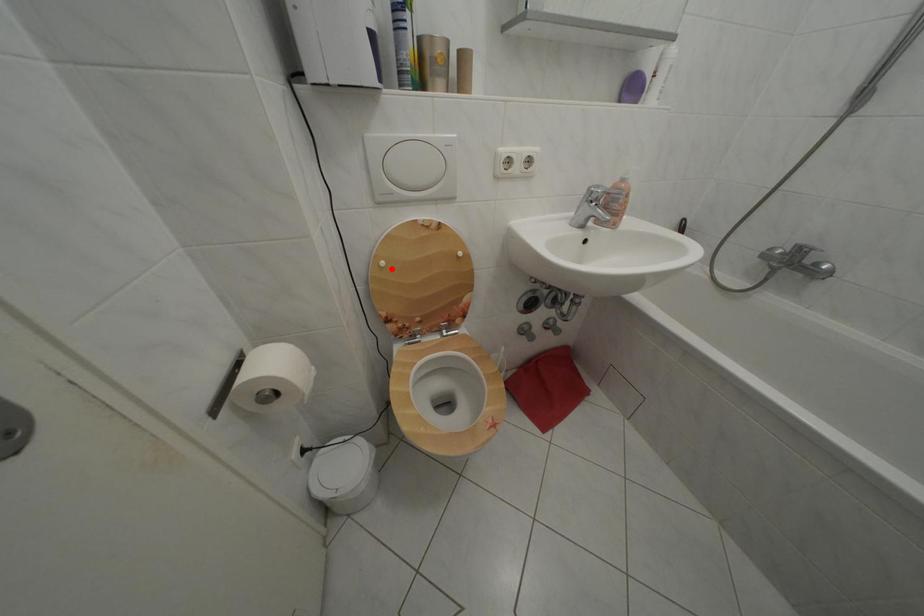
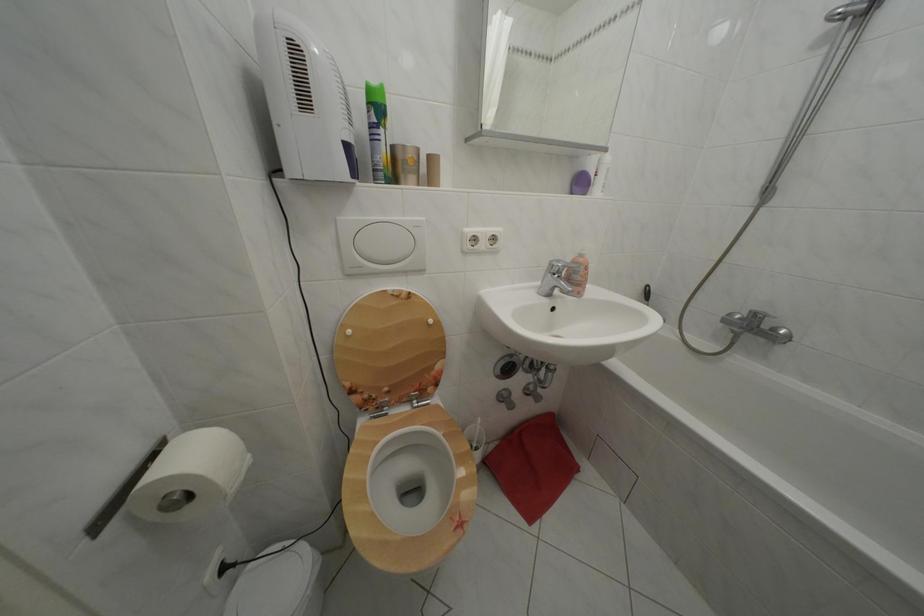
The point at the highlighted location is marked in the first image. Where is the corresponding point in the second image?

(358, 338)